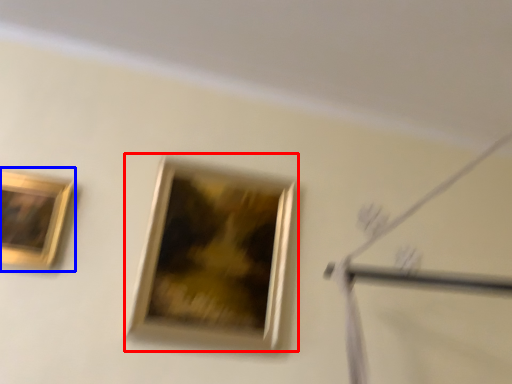
Question: Which object appears farthest to the camera in this image, picture frame (highlighted by a red box) or picture frame (highlighted by a blue box)?

Choices:
 (A) picture frame
 (B) picture frame

Answer: (A)